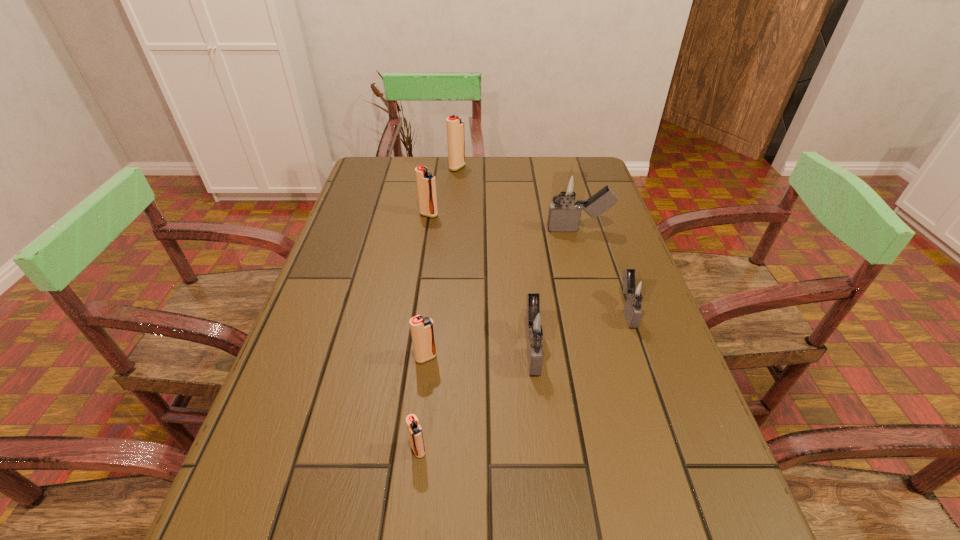
Image resolution: width=960 pixels, height=540 pixels. In the image, there is a desktop. Find the location of `vacant space at the far edge`. vacant space at the far edge is located at coordinates (515, 164).

Image resolution: width=960 pixels, height=540 pixels. In the image, there is a desktop. In order to click on vacant space at the left edge in this screenshot , I will do `click(375, 285)`.

Locate an element on the screen. free space at the right edge of the desktop is located at coordinates (631, 388).

Where is `free point between the second farthest red igniter and the third biggest red igniter`? This screenshot has height=540, width=960. free point between the second farthest red igniter and the third biggest red igniter is located at coordinates (427, 286).

Find the location of a particular element. The image size is (960, 540). vacant space that is in between the sixth nearest igniter and the fifth nearest igniter is located at coordinates (504, 222).

Locate an element on the screen. The image size is (960, 540). vacant area that lies between the third biggest red igniter and the farthest gray igniter is located at coordinates (502, 293).

This screenshot has height=540, width=960. I want to click on free space between the leftmost gray igniter and the farthest gray igniter, so click(556, 289).

Find the location of `free point between the farthest gray igniter and the second nearest red igniter`. free point between the farthest gray igniter and the second nearest red igniter is located at coordinates (502, 293).

Find the location of a particular element. vacant space that's between the second biggest gray igniter and the fifth nearest object is located at coordinates (556, 289).

This screenshot has height=540, width=960. In order to click on vacant area that lies between the nearest object and the farthest object in this screenshot , I will do `click(438, 308)`.